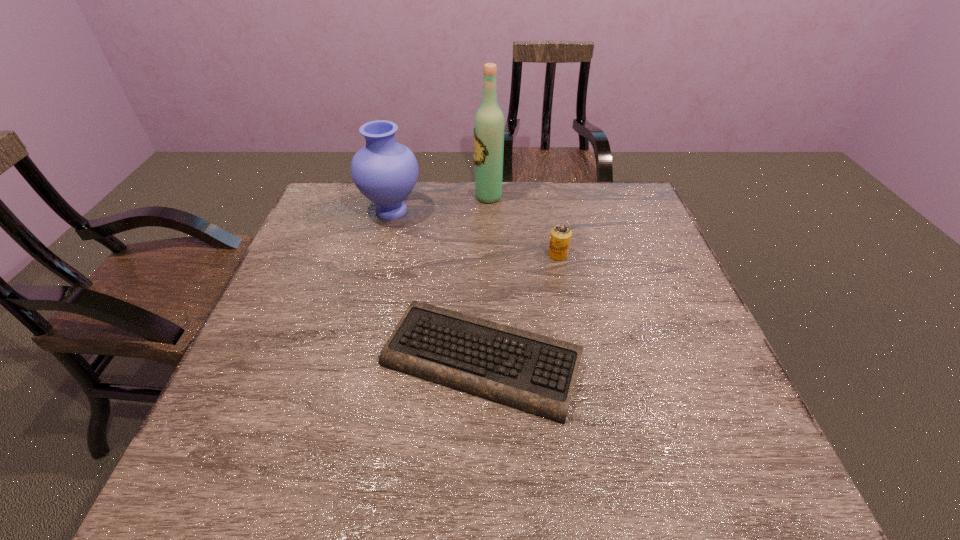
This screenshot has width=960, height=540. In order to click on wine bottle in this screenshot , I will do `click(489, 126)`.

Where is `the third shortest object`? the third shortest object is located at coordinates (385, 171).

Identify the location of beer can. This screenshot has height=540, width=960. pos(560,238).

Identify the location of the second nearest object. (560, 238).

You are a GUI agent. You are given a task and a screenshot of the screen. Output one action in this format:
    pyautogui.click(x=<x>, y=<y>)
    Task: Click on the shortest object
    The height and width of the screenshot is (540, 960).
    Given the screenshot: What is the action you would take?
    pyautogui.click(x=535, y=373)

Find the location of a particular element. The height and width of the screenshot is (540, 960). computer keyboard is located at coordinates (535, 373).

You are a GUI agent. You are given a task and a screenshot of the screen. Output one action in this format:
    pyautogui.click(x=<x>, y=<y>)
    Task: Click on the vacant space positioned on the front-facing side of the wine bottle
    This screenshot has height=540, width=960.
    Given the screenshot: What is the action you would take?
    pyautogui.click(x=354, y=197)

At what (x,y) coordinates should I click in order to perform the action: click on vacant space located on the front-facing side of the wine bottle. Please return your answer as a coordinate pair (x, y). The image size is (960, 540). Looking at the image, I should click on (428, 197).

The image size is (960, 540). I want to click on free region located on the front-facing side of the wine bottle, so pyautogui.click(x=444, y=197).

I want to click on free space located on the right of the vase, so click(480, 211).